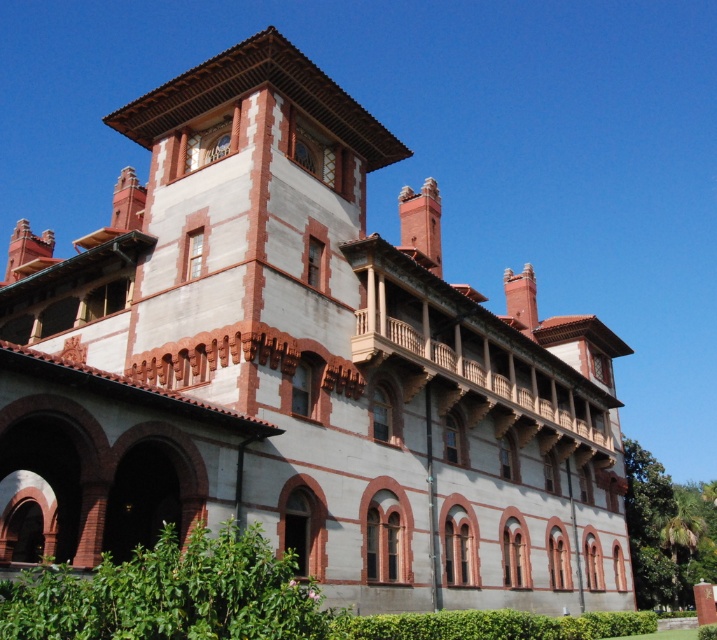
Does green leafy hedge at lower left appear on the right side of green leafy hedge at lower center?

No, green leafy hedge at lower left is not to the right of green leafy hedge at lower center.

Is green leafy hedge at lower left thinner than green leafy hedge at lower center?

Correct, green leafy hedge at lower left's width is less than green leafy hedge at lower center's.

Is point (105, 563) closer to viewer compared to point (495, 621)?

Yes, point (105, 563) is in front of point (495, 621).

Locate an element on the screen. The height and width of the screenshot is (640, 717). green leafy hedge at lower left is located at coordinates [170, 593].